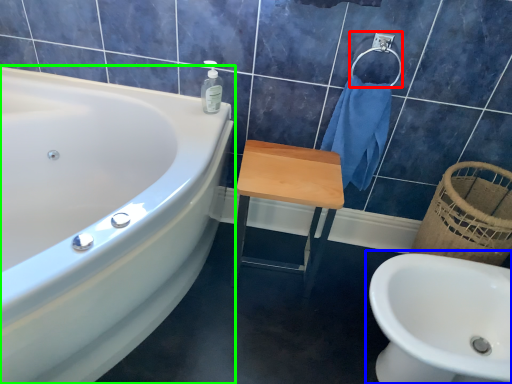
Question: Which object is positioned farthest from towel bar (highlighted by a red box)? Select from sink (highlighted by a blue box) and bathtub (highlighted by a green box).

Choices:
 (A) sink
 (B) bathtub

Answer: (B)